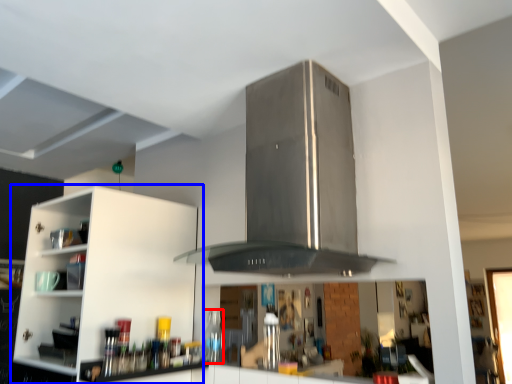
Question: Which object appears closest to the camera in this image, bottle (highlighted by a red box) or cabinetry (highlighted by a blue box)?

Choices:
 (A) bottle
 (B) cabinetry

Answer: (B)